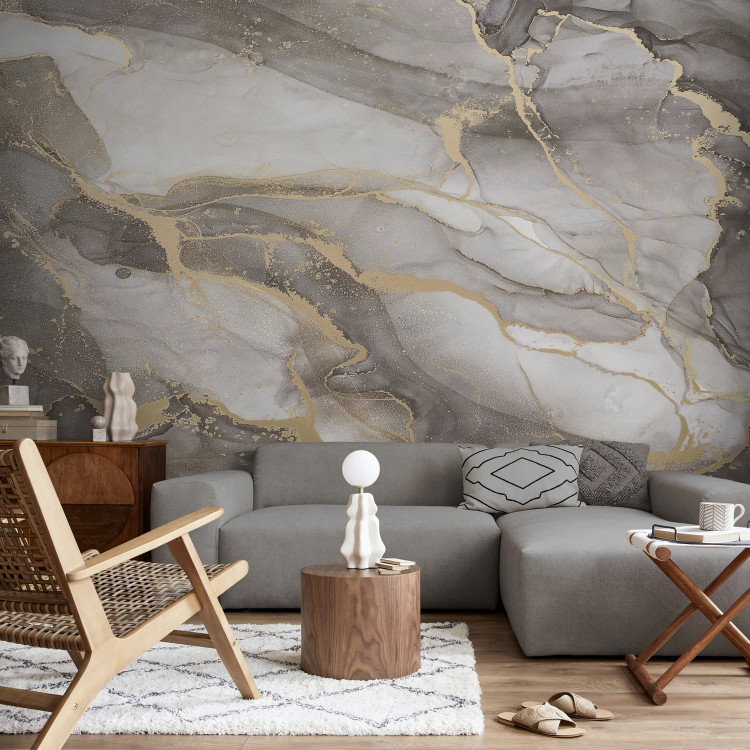
Find the location of a particular element. 1 grey sectional is located at coordinates (580, 524).